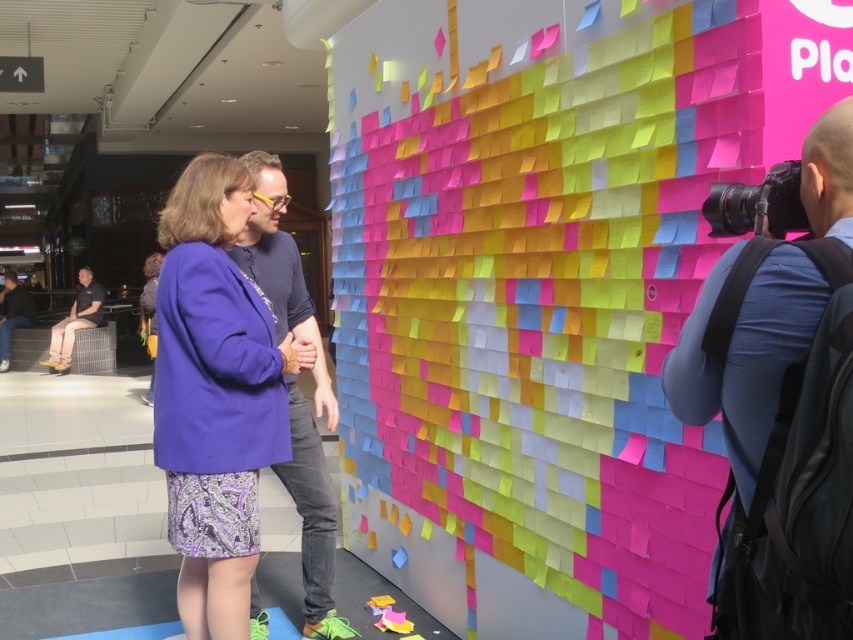
You are standing in the room and want to take a photo of the wall with the colorful sticky notes. The blue fabric camera at right is to the right of the khaki cotton pants at lower left. Which object should you pick up first to take the photo?

You should pick up the blue fabric camera at right first because it is positioned to the right of the khaki cotton pants at lower left, making it more accessible for taking the photo.

You are a photographer who needs to retrieve your blue fabric camera at right to take a photo of the sticky note wall. However, your khaki cotton pants at lower left is blocking the camera. Can you easily access the camera without moving the pants?

The blue fabric camera at right is located below the khaki cotton pants at lower left, so you can easily access the camera by moving the pants out of the way since it is positioned underneath.

You are a photographer who needs to place your blue fabric camera at right on top of the khaki cotton pants at lower left. Is the camera tall enough to sit on the pants without falling over?

The blue fabric camera at right is shorter than khaki cotton pants at lower left, so it may not be tall enough to provide stability and could potentially fall over.